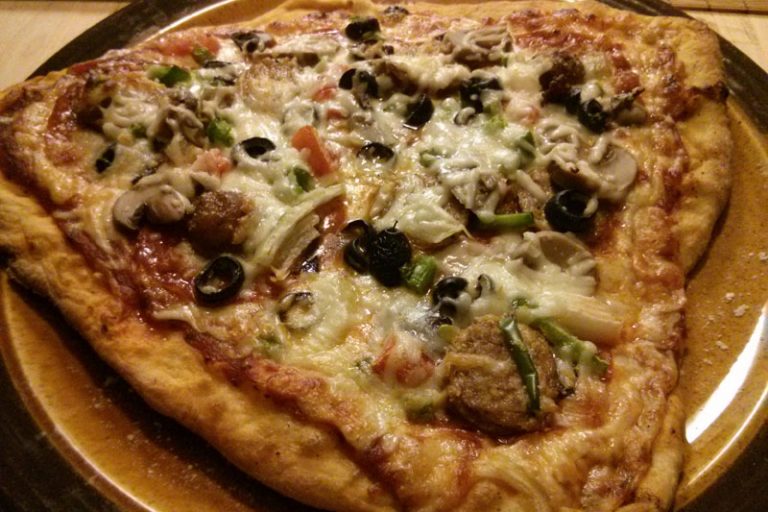
Where is `light relection on rim of plate`? Image resolution: width=768 pixels, height=512 pixels. light relection on rim of plate is located at coordinates (714, 401), (740, 438), (124, 493), (196, 18).